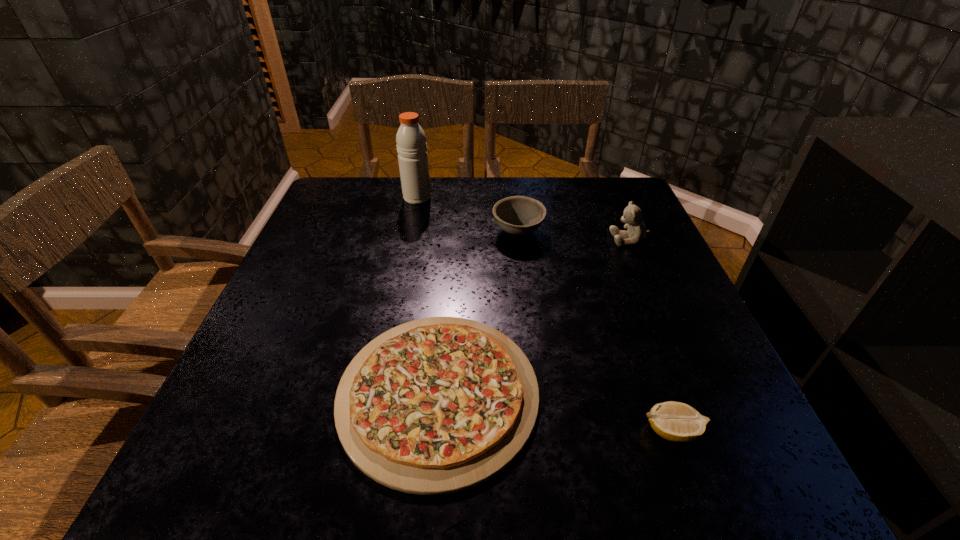
Locate an element on the screen. The height and width of the screenshot is (540, 960). free space that satisfies the following two spatial constraints: 1. on the back side of the pizza; 2. on the right side of the bowl is located at coordinates [452, 232].

Locate an element on the screen. free spot that satisfies the following two spatial constraints: 1. on the front side of the shaker; 2. on the left side of the pizza is located at coordinates (377, 394).